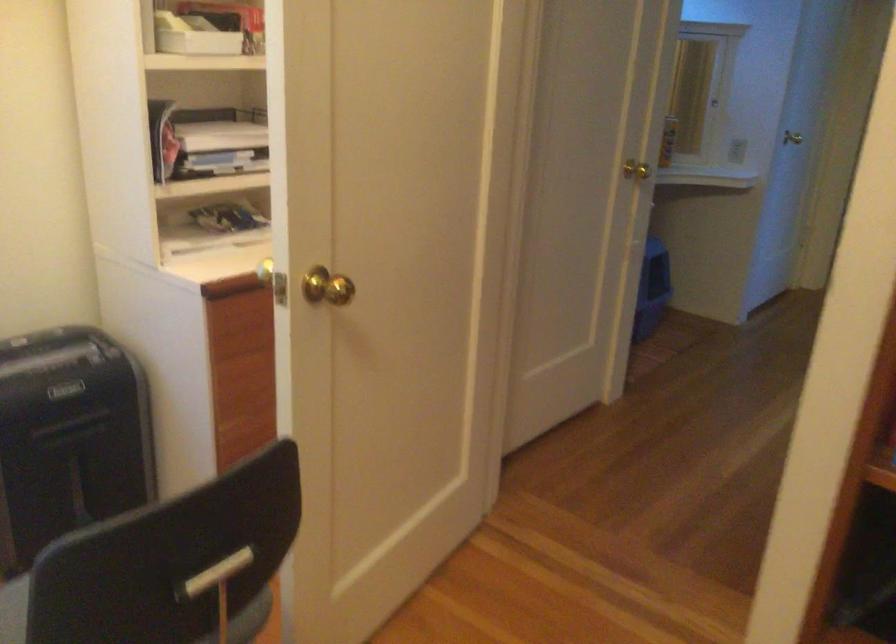
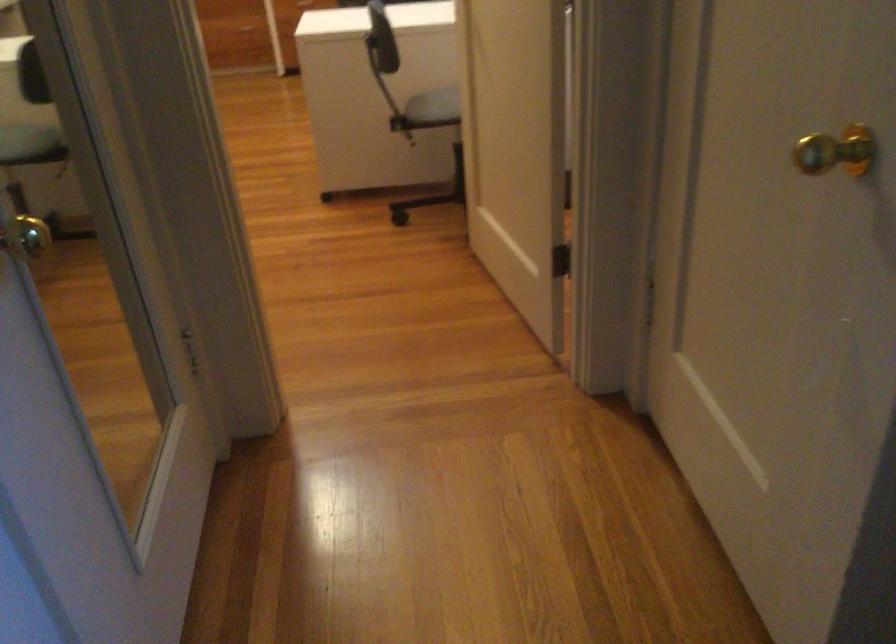
Locate, in the second image, the point that corresponds to point 627,174 in the first image.

(836, 152)